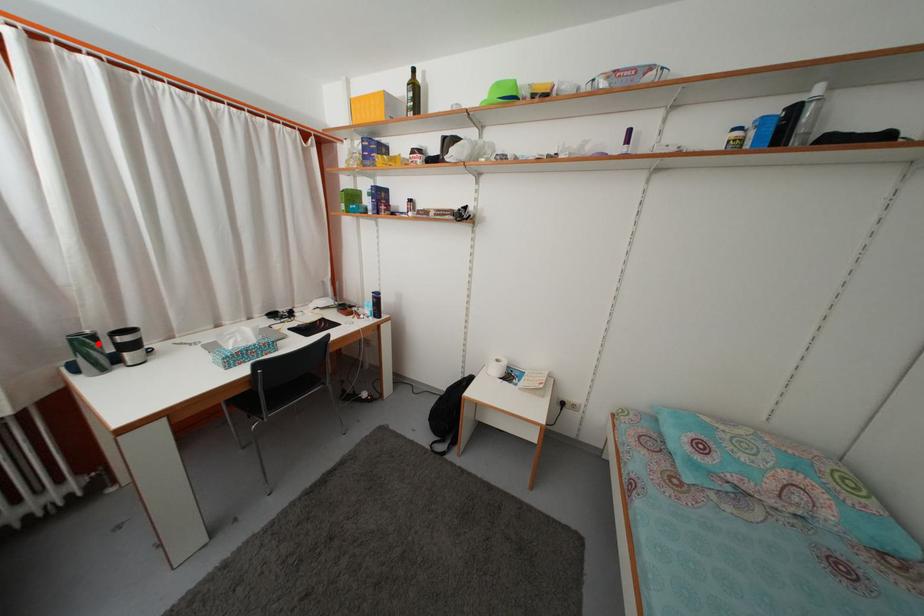
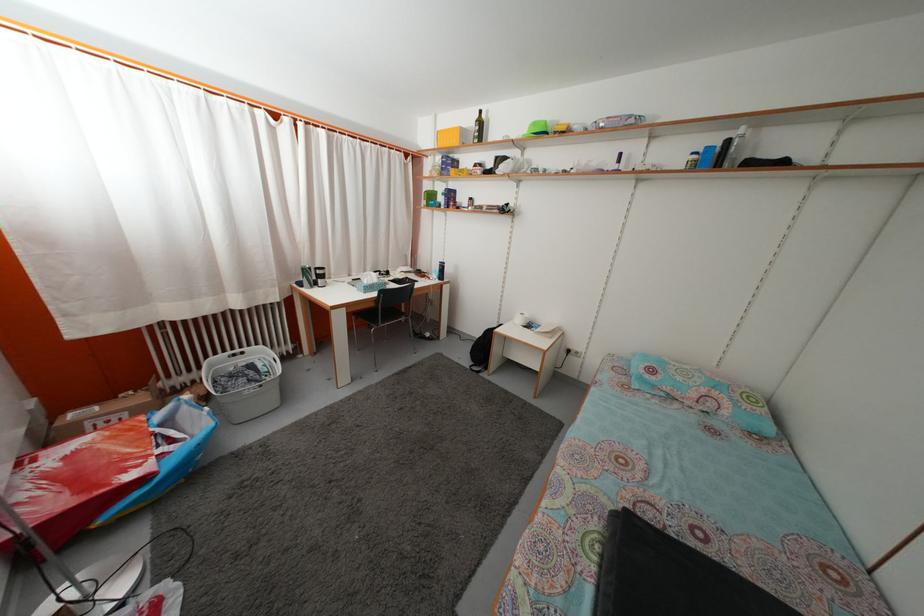
Question: I am providing you with two images of the same scene from different viewpoints. A red point is shown in image1. For the corresponding object point in image2, is it positioned nearer or farther from the camera?

Choices:
 (A) Nearer
 (B) Farther

Answer: (A)